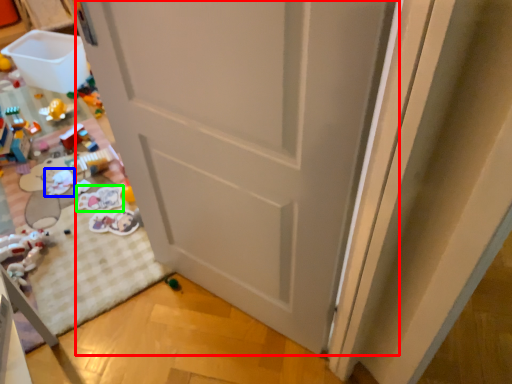
Question: Estimate the real-world distances between objects in this image. Which object is closer to door (highlighted by a red box), toy (highlighted by a blue box) or toy (highlighted by a green box)?

Choices:
 (A) toy
 (B) toy

Answer: (B)